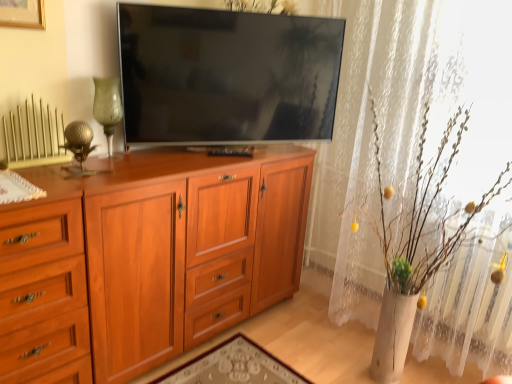
Question: Is the depth of light brown wood drawer at left less than that of brushed gold picture frame at upper left?

Choices:
 (A) no
 (B) yes

Answer: (B)

Question: Is light brown wood drawer at left turned away from brushed gold picture frame at upper left?

Choices:
 (A) no
 (B) yes

Answer: (A)

Question: From a real-world perspective, is light brown wood drawer at left beneath brushed gold picture frame at upper left?

Choices:
 (A) no
 (B) yes

Answer: (B)

Question: Is light brown wood drawer at left thinner than brushed gold picture frame at upper left?

Choices:
 (A) yes
 (B) no

Answer: (B)

Question: From the image's perspective, is light brown wood drawer at left above brushed gold picture frame at upper left?

Choices:
 (A) yes
 (B) no

Answer: (B)

Question: From a real-world perspective, is light brown wood drawer at left physically above brushed gold picture frame at upper left?

Choices:
 (A) yes
 (B) no

Answer: (B)

Question: Considering the relative sizes of light brown wood drawer at left and light brown wood cabinet at center in the image provided, is light brown wood drawer at left wider than light brown wood cabinet at center?

Choices:
 (A) no
 (B) yes

Answer: (B)

Question: Is light brown wood drawer at left not close to light brown wood cabinet at center?

Choices:
 (A) yes
 (B) no

Answer: (B)

Question: Does light brown wood drawer at left turn towards light brown wood cabinet at center?

Choices:
 (A) no
 (B) yes

Answer: (A)

Question: From a real-world perspective, is light brown wood drawer at left below light brown wood cabinet at center?

Choices:
 (A) no
 (B) yes

Answer: (A)

Question: Does light brown wood drawer at left contain light brown wood cabinet at center?

Choices:
 (A) no
 (B) yes

Answer: (A)

Question: Is light brown wood drawer at left taller than light brown wood cabinet at center?

Choices:
 (A) yes
 (B) no

Answer: (B)

Question: Considering the relative positions of gold metallic radiator at upper left and light brown wood cabinet at center in the image provided, is gold metallic radiator at upper left behind light brown wood cabinet at center?

Choices:
 (A) no
 (B) yes

Answer: (B)